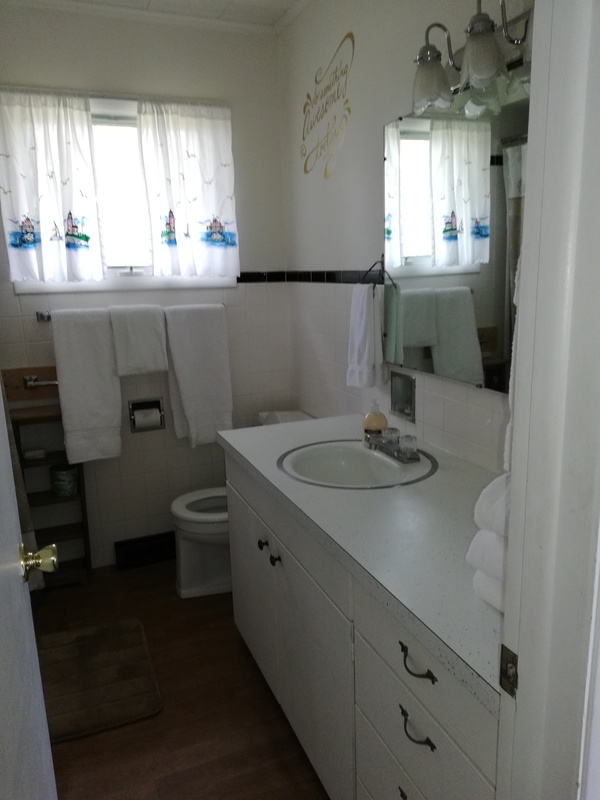
Where is `curtains`? curtains is located at coordinates (44, 178), (205, 190).